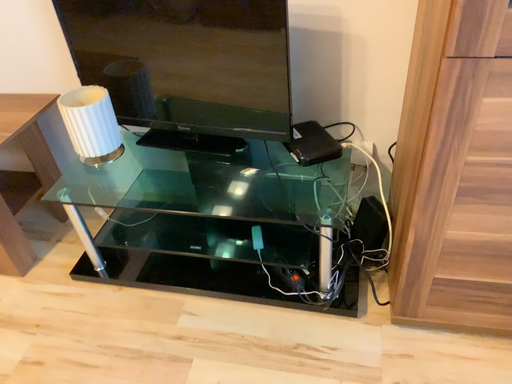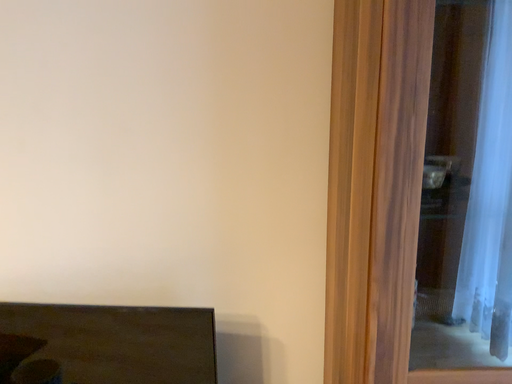
Question: Which way did the camera rotate in the video?

Choices:
 (A) rotated right
 (B) rotated left

Answer: (A)